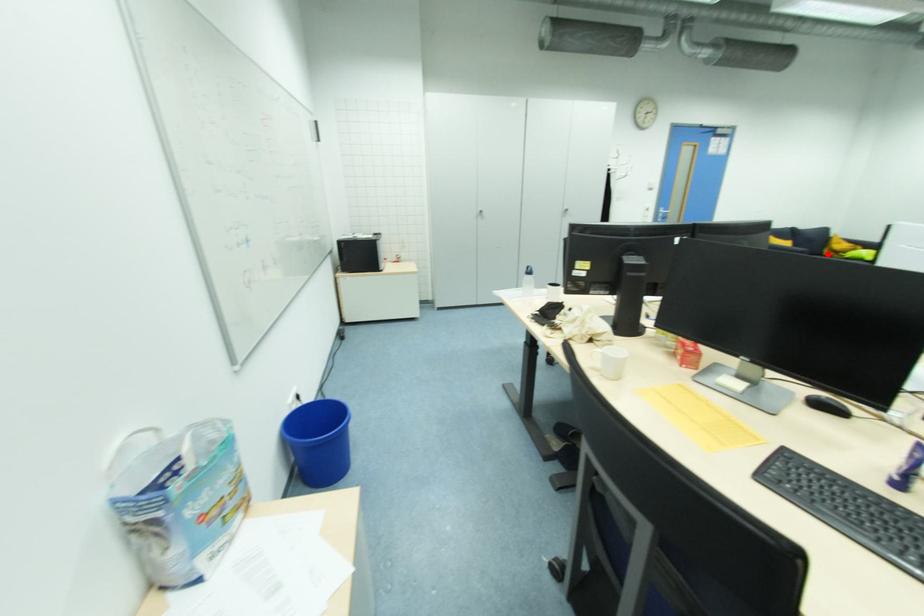
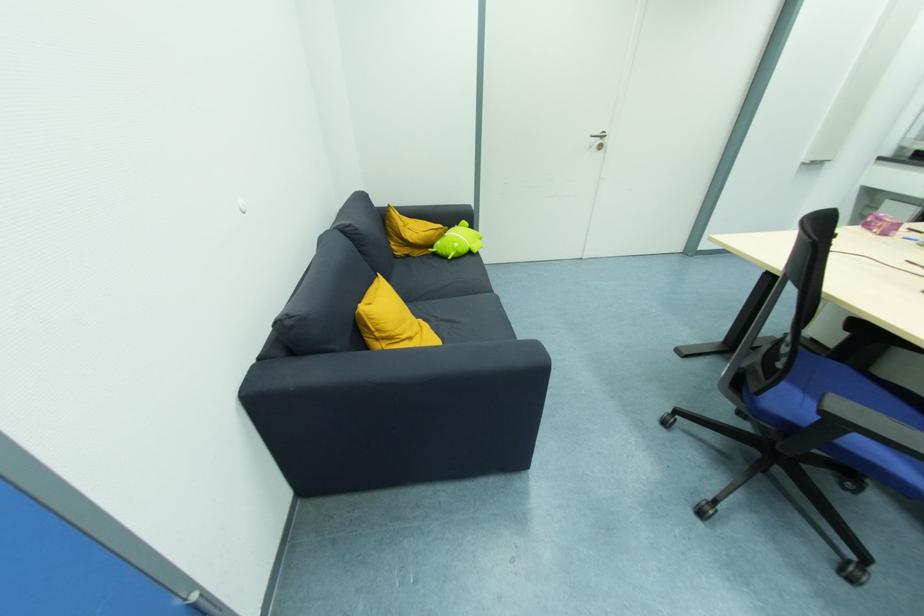
Locate, in the second image, the point that corresponds to the highlighted location in the first image.

(403, 253)